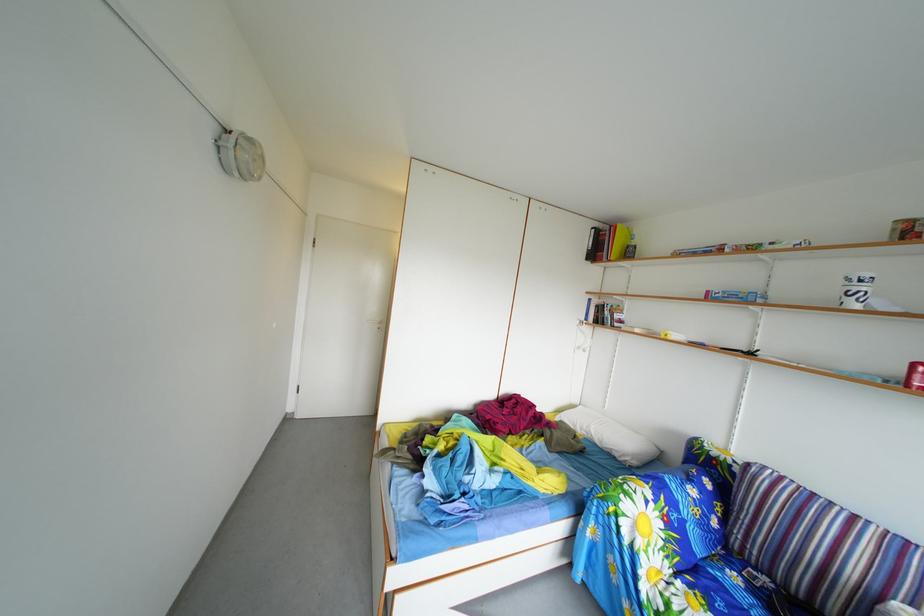
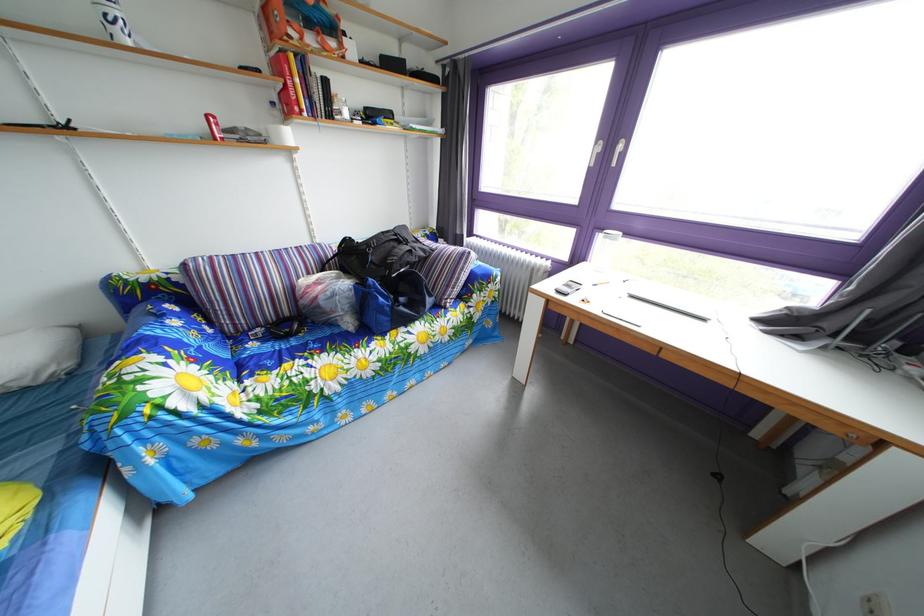
The point at (x=746, y=585) is marked in the first image. Where is the corresponding point in the second image?

(262, 353)